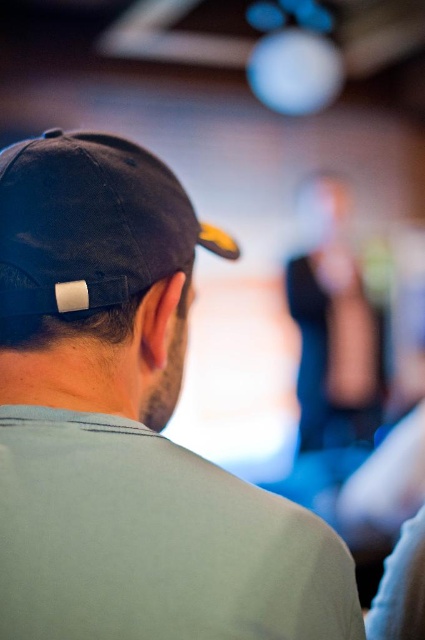
You are a photographer trying to capture a clear shot of the black matte cap at upper left and the black fabric baseball cap at upper left. Since both are placed at the upper left, which one is closer to the camera?

The black matte cap at upper left is in front of the black fabric baseball cap at upper left, so it is closer to the camera.

You are standing in a dimly lit indoor space and see the black matte cap at upper left. If you want to move closer to it, which direction should you move relative to your current position?

The black matte cap at upper left is located at point (127, 424) in the image, so you should move towards the upper left direction to get closer to it.